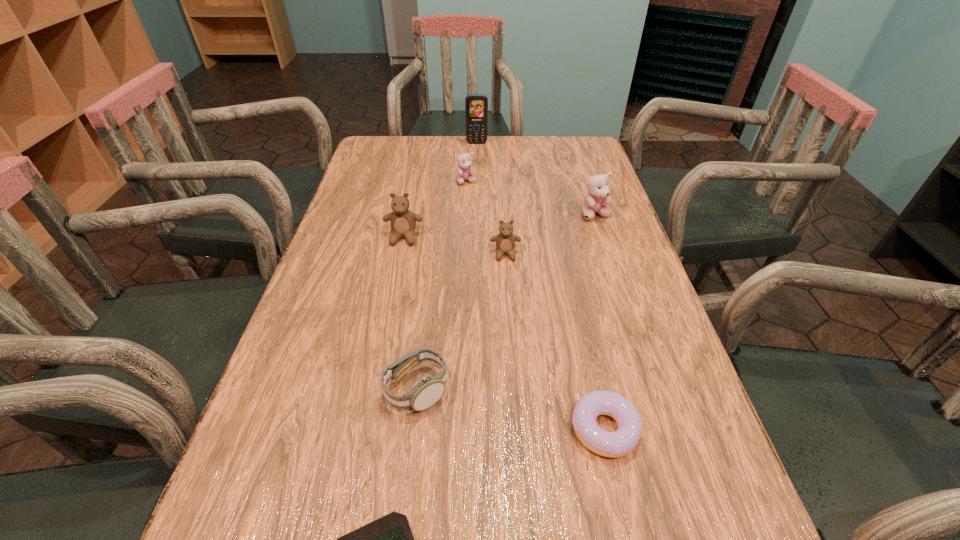
Identify the location of the farthest object. (476, 105).

I want to click on the tallest object, so click(476, 105).

The width and height of the screenshot is (960, 540). What are the coordinates of `the left brown teddy bear` in the screenshot? It's located at (403, 222).

The image size is (960, 540). I want to click on the bigger brown teddy bear, so click(403, 222).

Find the location of a particular element. the third nearest teddy bear is located at coordinates (598, 192).

The image size is (960, 540). I want to click on the bigger pink teddy bear, so coord(598,192).

Find the location of a particular element. The height and width of the screenshot is (540, 960). the right brown teddy bear is located at coordinates (505, 241).

Where is `the smaller brown teddy bear`? This screenshot has width=960, height=540. the smaller brown teddy bear is located at coordinates coord(505,241).

The width and height of the screenshot is (960, 540). I want to click on the farther pink teddy bear, so click(465, 170).

What are the coordinates of `the left pink teddy bear` in the screenshot? It's located at (465, 170).